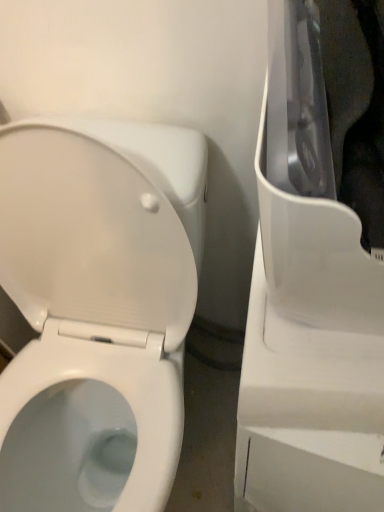
Question: Is there a large distance between white glossy toilet at left and white plastic appliance at right?

Choices:
 (A) yes
 (B) no

Answer: (B)

Question: From a real-world perspective, does white glossy toilet at left sit lower than white plastic appliance at right?

Choices:
 (A) yes
 (B) no

Answer: (A)

Question: Is white glossy toilet at left placed right next to white plastic appliance at right?

Choices:
 (A) yes
 (B) no

Answer: (B)

Question: From a real-world perspective, is white glossy toilet at left located higher than white plastic appliance at right?

Choices:
 (A) yes
 (B) no

Answer: (B)

Question: Is white glossy toilet at left oriented away from white plastic appliance at right?

Choices:
 (A) yes
 (B) no

Answer: (B)

Question: Does white glossy toilet at left have a greater width compared to white plastic appliance at right?

Choices:
 (A) no
 (B) yes

Answer: (B)

Question: From a real-world perspective, is white plastic appliance at right on white glossy toilet at left?

Choices:
 (A) yes
 (B) no

Answer: (A)

Question: Can you confirm if white plastic appliance at right is smaller than white glossy toilet at left?

Choices:
 (A) no
 (B) yes

Answer: (B)

Question: Would you say white plastic appliance at right is a long distance from white glossy toilet at left?

Choices:
 (A) no
 (B) yes

Answer: (A)

Question: Could white glossy toilet at left be considered to be inside white plastic appliance at right?

Choices:
 (A) yes
 (B) no

Answer: (B)

Question: Is white plastic appliance at right further to camera compared to white glossy toilet at left?

Choices:
 (A) yes
 (B) no

Answer: (B)

Question: Considering the relative sizes of white plastic appliance at right and white glossy toilet at left in the image provided, is white plastic appliance at right bigger than white glossy toilet at left?

Choices:
 (A) yes
 (B) no

Answer: (B)

Question: Would you say white glossy toilet at left is to the left or to the right of white plastic appliance at right in the picture?

Choices:
 (A) right
 (B) left

Answer: (B)